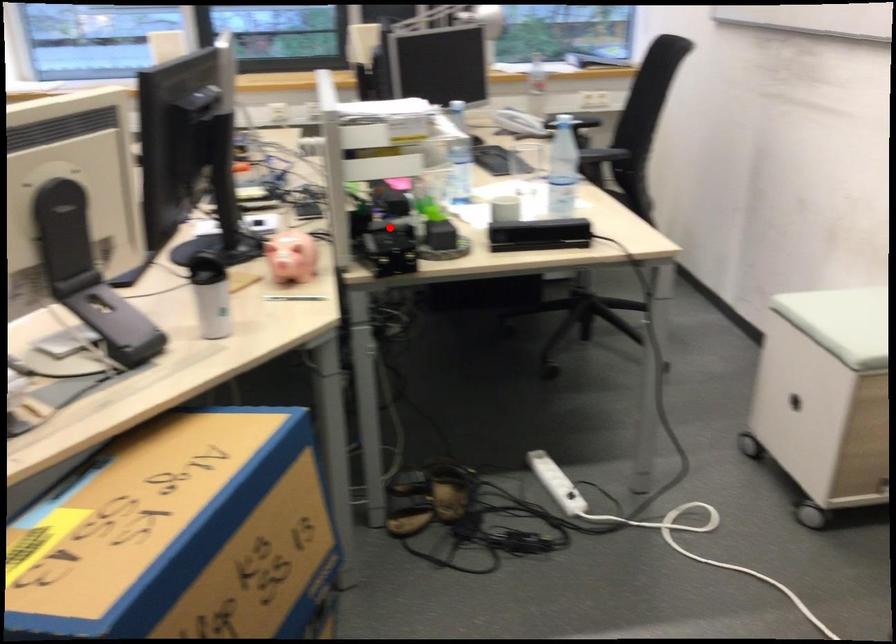
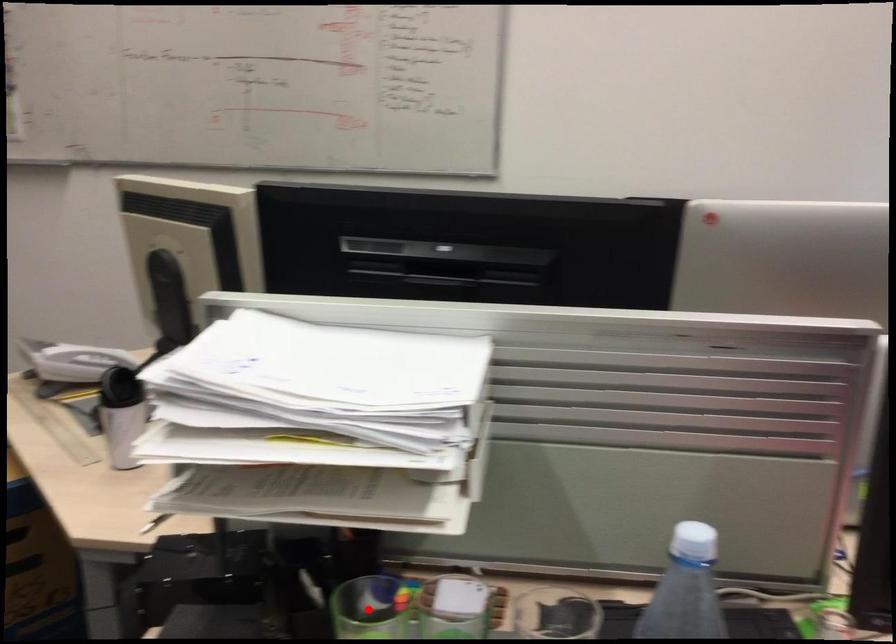
I am providing you with two images of the same scene from different viewpoints. A red point is marked on the first image and another point is marked on the second image. Is the red point in image1 aligned with the point shown in image2?

Yes